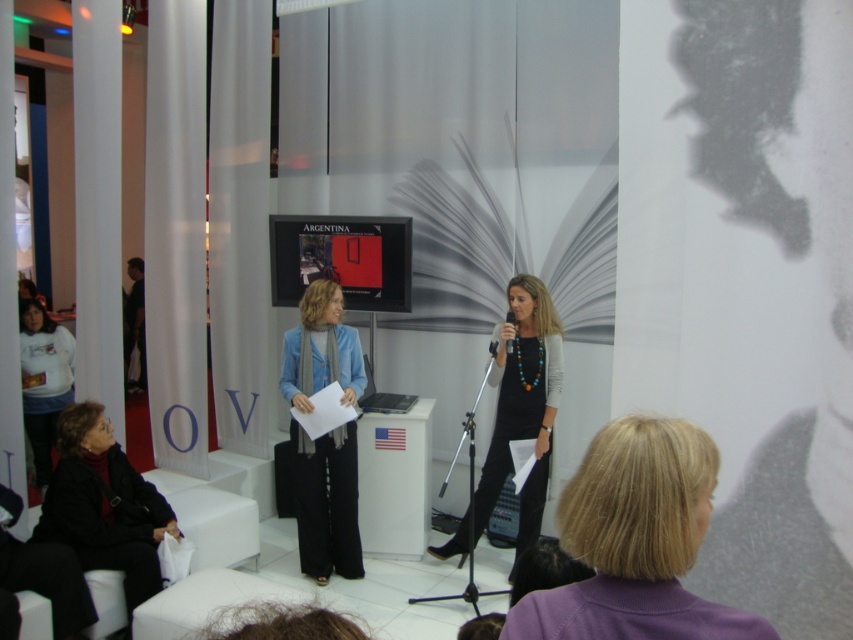
Question: Estimate the real-world distances between objects in this image. Which object is farther from the dark blue fabric at left?

Choices:
 (A) white matte shirt at left
 (B) black leather jacket at lower left

Answer: (B)

Question: Among these points, which one is nearest to the camera?

Choices:
 (A) (515, 304)
 (B) (137, 333)
 (C) (315, 524)
 (D) (33, 538)

Answer: (D)

Question: Estimate the real-world distances between objects in this image. Which object is closer to the blonde hair at center?

Choices:
 (A) blue woolen scarf at center
 (B) black leather jacket at lower left
 (C) black plastic microphone at center

Answer: (C)

Question: Does blue woolen scarf at center have a greater width compared to dark blue fabric at left?

Choices:
 (A) no
 (B) yes

Answer: (B)

Question: From the image, what is the correct spatial relationship of white matte shirt at left in relation to black plastic microphone at center?

Choices:
 (A) above
 (B) below

Answer: (B)

Question: Can you confirm if blue woolen scarf at center is thinner than black glossy dress at center?

Choices:
 (A) no
 (B) yes

Answer: (B)